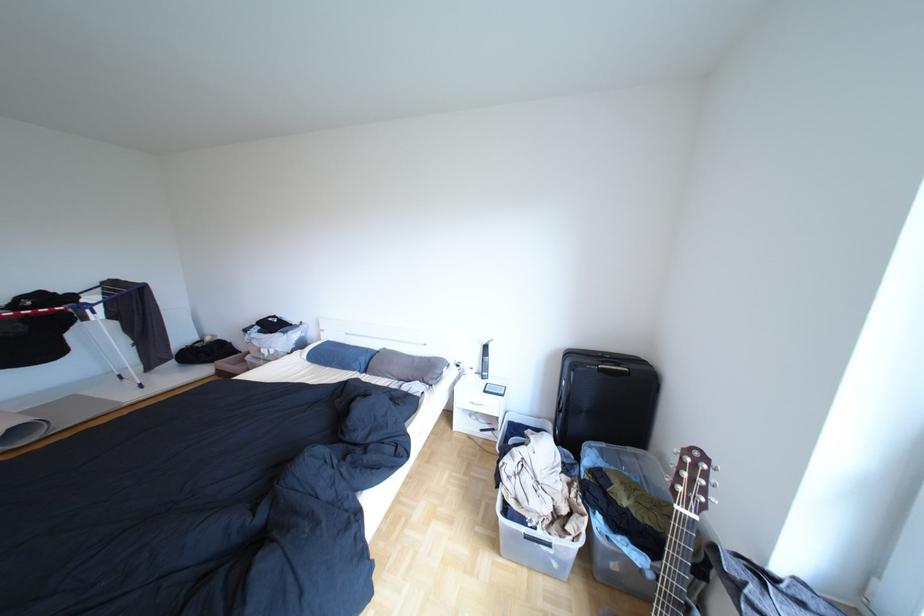
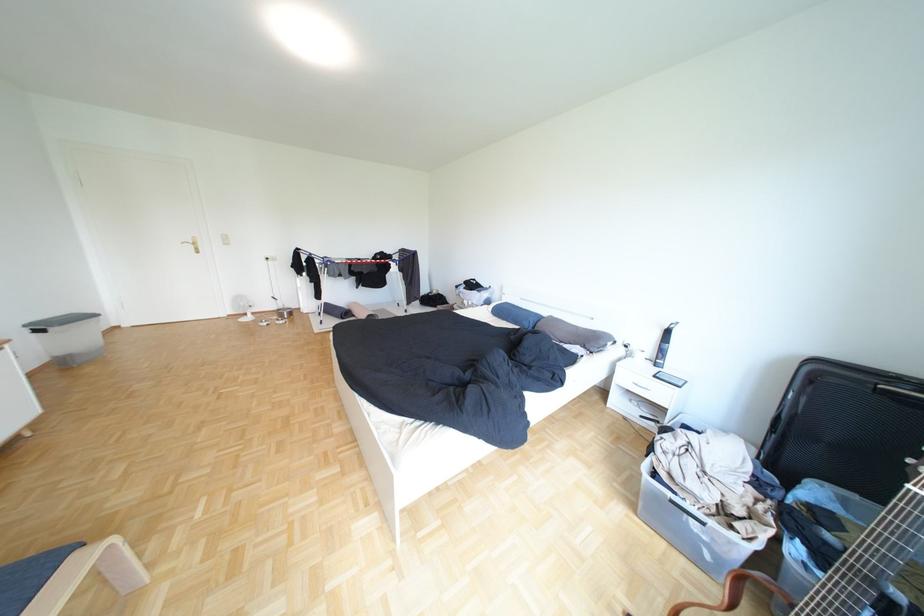
Where in the second image is the point corresponding to pixel 439 382 from the first image?

(600, 347)